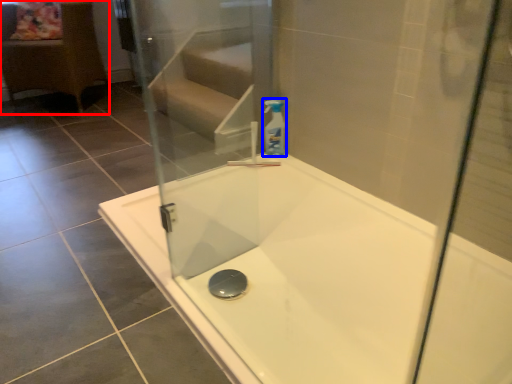
Question: Which of the following is the farthest to the observer, furniture (highlighted by a red box) or cleaning product (highlighted by a blue box)?

Choices:
 (A) furniture
 (B) cleaning product

Answer: (A)